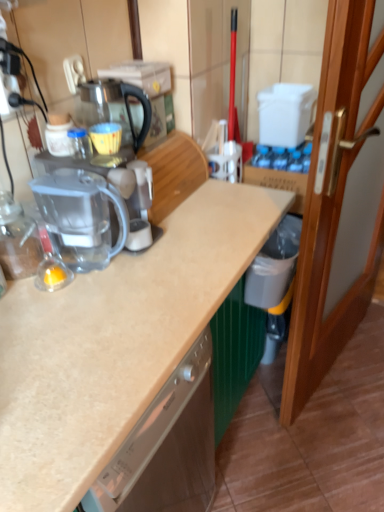
Locate an element on the screen. This screenshot has width=384, height=512. free point above transparent plastic coffee machine at center (from a real-world perspective) is located at coordinates (85, 149).